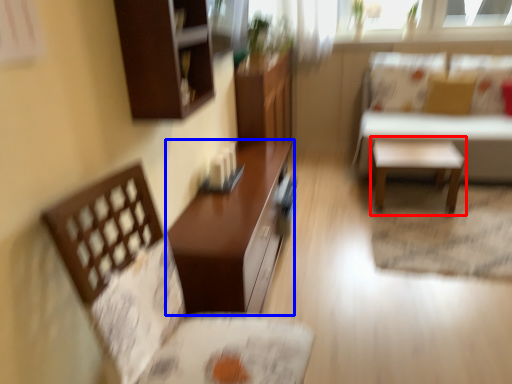
Question: Which object appears farthest to the camera in this image, side table (highlighted by a red box) or table (highlighted by a blue box)?

Choices:
 (A) side table
 (B) table

Answer: (A)